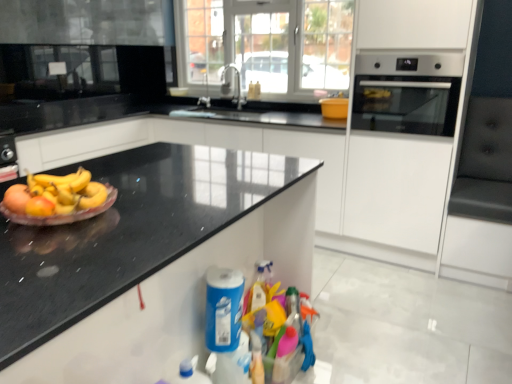
Question: Do you think translucent plastic plate at left is within transparent glass door at center, or outside of it?

Choices:
 (A) outside
 (B) inside

Answer: (A)

Question: Is translucent plastic plate at left bigger or smaller than transparent glass door at center?

Choices:
 (A) big
 (B) small

Answer: (B)

Question: Estimate the real-world distances between objects in this image. Which object is closer to the transparent glass door at center?

Choices:
 (A) blue plastic cleaning product at lower center
 (B) satin nickel faucet at center
 (C) translucent plastic plate at left
 (D) black granite countertop at left
 (E) silver metallic faucet at upper center

Answer: (B)

Question: Which of these objects is positioned closest to the satin nickel faucet at center?

Choices:
 (A) translucent plastic plate at left
 (B) transparent glass door at center
 (C) silver metallic faucet at upper center
 (D) black granite countertop at left
 (E) satin silver oven at right

Answer: (C)